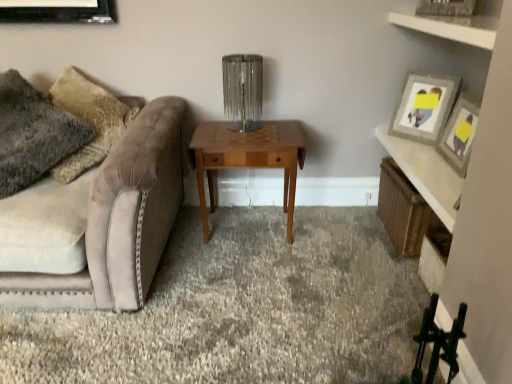
Where is `vacant region in front of wooden table at center`? vacant region in front of wooden table at center is located at coordinates (247, 279).